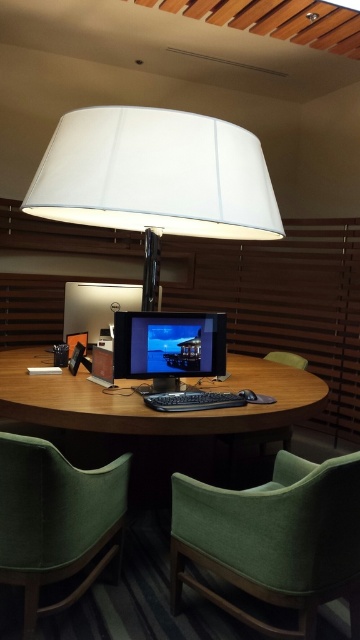
Question: Which point is closer to the camera?

Choices:
 (A) (195, 337)
 (B) (23, 636)
 (C) (290, 413)

Answer: (B)

Question: Does green fabric swivel chair at lower center lie behind woodenmaterial/texturedesk at center?

Choices:
 (A) no
 (B) yes

Answer: (A)

Question: Where is white matte lampshade at upper center located in relation to woodenmaterial/texturedesk at center in the image?

Choices:
 (A) below
 (B) above

Answer: (B)

Question: Which of the following is the farthest from the observer?

Choices:
 (A) green fabric swivel chair at lower left
 (B) woodenmaterial/texturedesk at center
 (C) satin black monitor at center
 (D) green fabric swivel chair at lower center

Answer: (C)

Question: Does white matte lampshade at upper center appear on the left side of green fabric swivel chair at lower left?

Choices:
 (A) no
 (B) yes

Answer: (A)

Question: Based on their relative distances, which object is farther from the green fabric swivel chair at lower center?

Choices:
 (A) satin black monitor at center
 (B) green fabric swivel chair at lower left
 (C) white matte lampshade at upper center

Answer: (C)